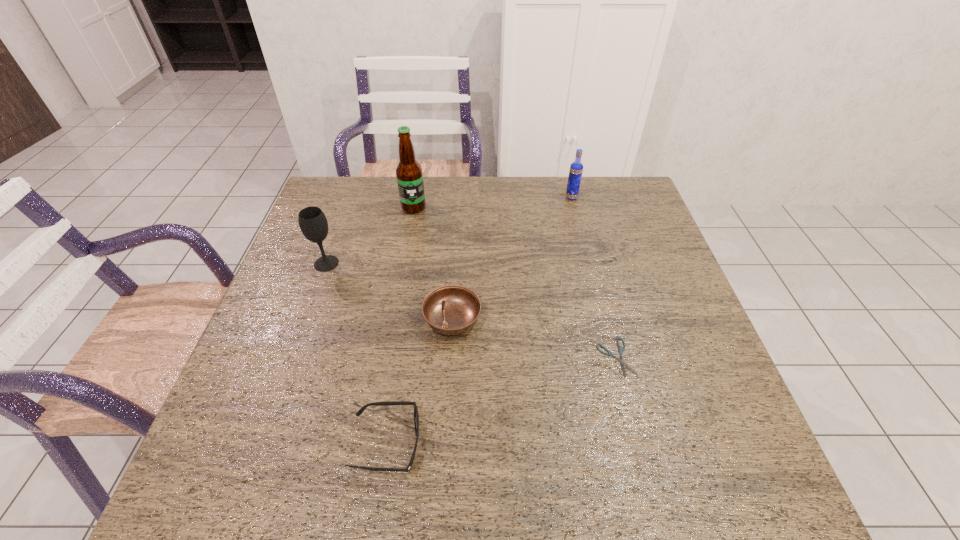
Locate an element on the screen. The height and width of the screenshot is (540, 960). vacant space that's between the soup bowl and the beer bottle is located at coordinates point(433,264).

Where is `vacant space in between the soup bowl and the vodka`? This screenshot has width=960, height=540. vacant space in between the soup bowl and the vodka is located at coordinates (512, 258).

Identify the location of free space between the sunglasses and the vodka. (479, 321).

Where is `object that is the closest one to the beer bottle`? This screenshot has height=540, width=960. object that is the closest one to the beer bottle is located at coordinates (312, 221).

At what (x,y) coordinates should I click in order to perform the action: click on object that is the fourth closest to the soup bowl. Please return your answer as a coordinate pair (x, y). Looking at the image, I should click on (409, 175).

I want to click on free space in the image that satisfies the following two spatial constraints: 1. on the front side of the leftmost object; 2. on the right side of the soup bowl, so click(x=306, y=319).

Locate an element on the screen. The width and height of the screenshot is (960, 540). free region that satisfies the following two spatial constraints: 1. on the label of the shortest object; 2. on the left side of the beer bottle is located at coordinates (387, 358).